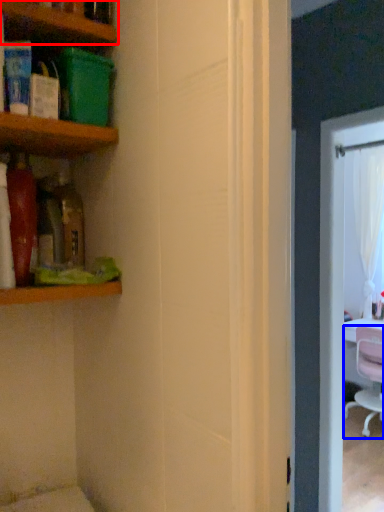
Question: Which point is further to the camera, shelf (highlighted by a red box) or chair (highlighted by a blue box)?

Choices:
 (A) shelf
 (B) chair

Answer: (B)